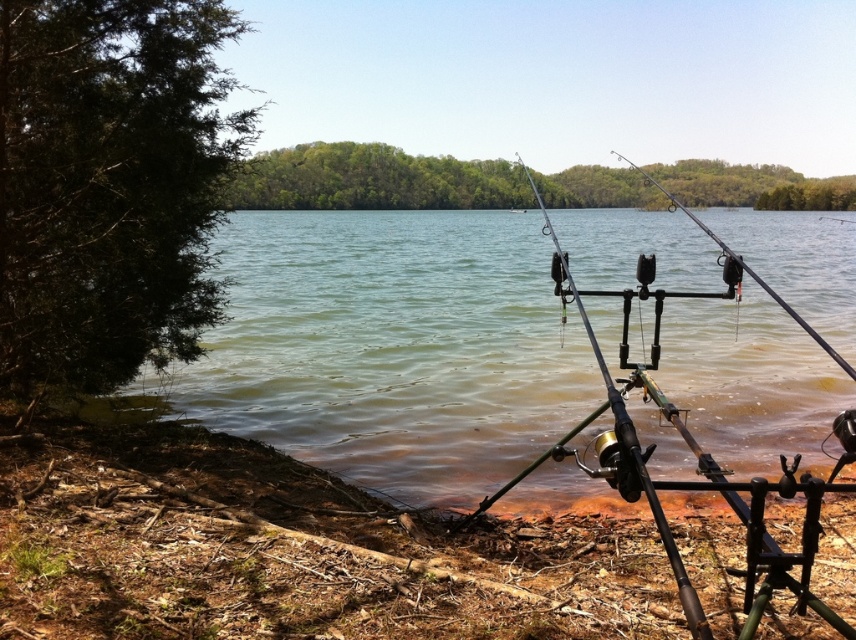
Is point (51, 550) positioned before point (696, 625)?

No, it is not.

Which of these two, brown dirt shoreline at lower left or metallic fishing pole at center, stands shorter?

With less height is brown dirt shoreline at lower left.

Between point (287, 611) and point (617, 410), which one is positioned in front?

Point (617, 410) is in front.

This screenshot has width=856, height=640. I want to click on brown dirt shoreline at lower left, so click(x=284, y=548).

Can you confirm if greenish water at center is bigger than metallic fishing pole at center?

Correct, greenish water at center is larger in size than metallic fishing pole at center.

In the scene shown: Is greenish water at center shorter than metallic fishing pole at center?

No.

Between point (378, 330) and point (626, 488), which one is positioned in front?

Point (626, 488) is in front.

This screenshot has width=856, height=640. Identify the location of greenish water at center. (391, 348).

Does point (617, 458) come in front of point (694, 221)?

Yes, point (617, 458) is closer to viewer.

Can you confirm if metallic fishing pole at center is smaller than black matte fishing pole at center?

Yes.

Where is `metallic fishing pole at center`? The height and width of the screenshot is (640, 856). metallic fishing pole at center is located at coordinates (626, 451).